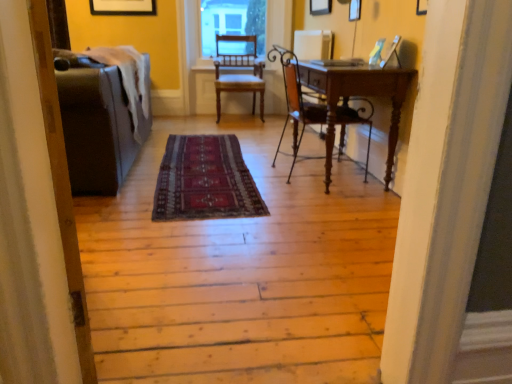
Where is `vacant area to the right of matte black couch at left`? vacant area to the right of matte black couch at left is located at coordinates (187, 301).